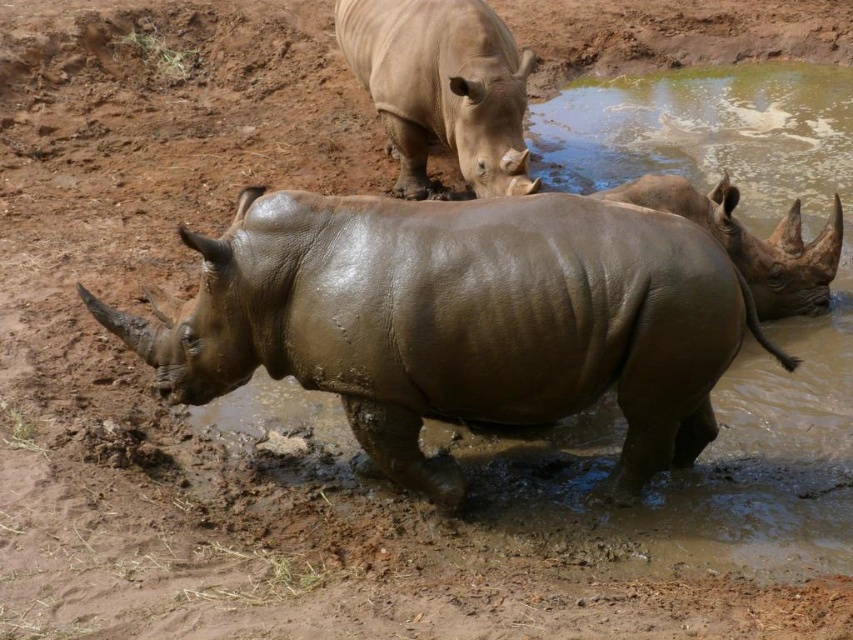
You are a wildlife photographer aiming to capture a photo of both the muddy brown rhinoceros at center and the smooth beige rhino at upper center. Which rhino should you focus on first if you want to include both in your frame without moving the camera?

The smooth beige rhino at upper center should be focused on first because the muddy brown rhinoceros at center is positioned to its right, allowing both to be captured in the frame by starting with the one on the left.

You are a wildlife photographer aiming to capture a photo of the muddy brown rhinoceros at center and the smooth beige rhino at upper center. If you want to ensure both rhinos are fully visible in the frame, which rhino should you position closer to the edge of the frame to avoid cropping?

You should position the muddy brown rhinoceros at center closer to the edge of the frame because it is wider than the smooth beige rhino at upper center, so it requires more space to be fully visible.